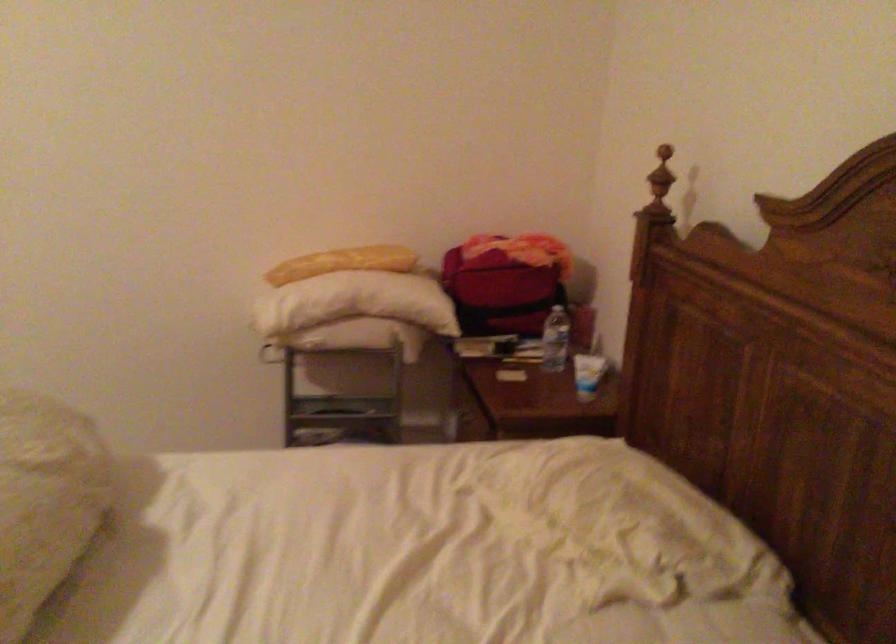
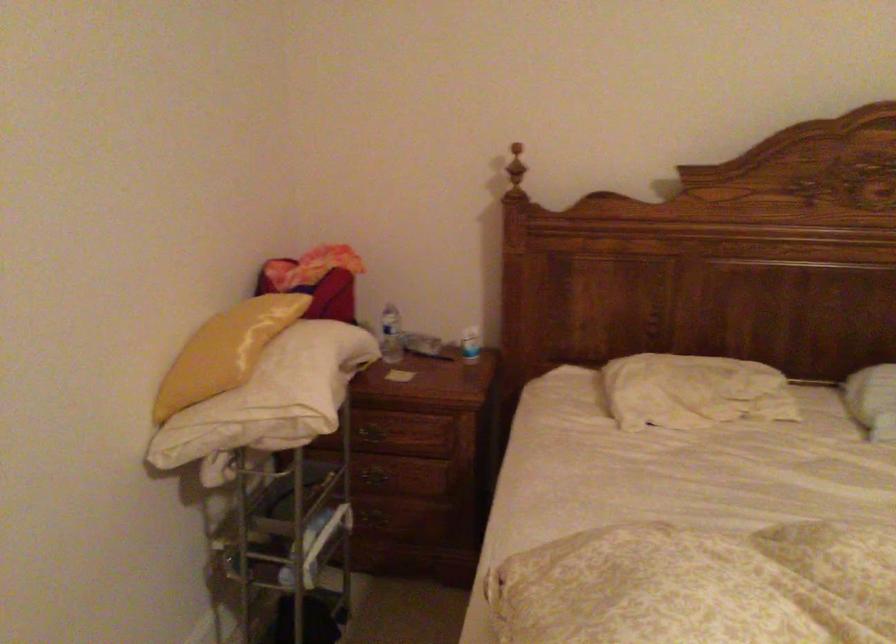
Where in the second image is the point corresponding to (467,410) from the first image?

(374, 430)